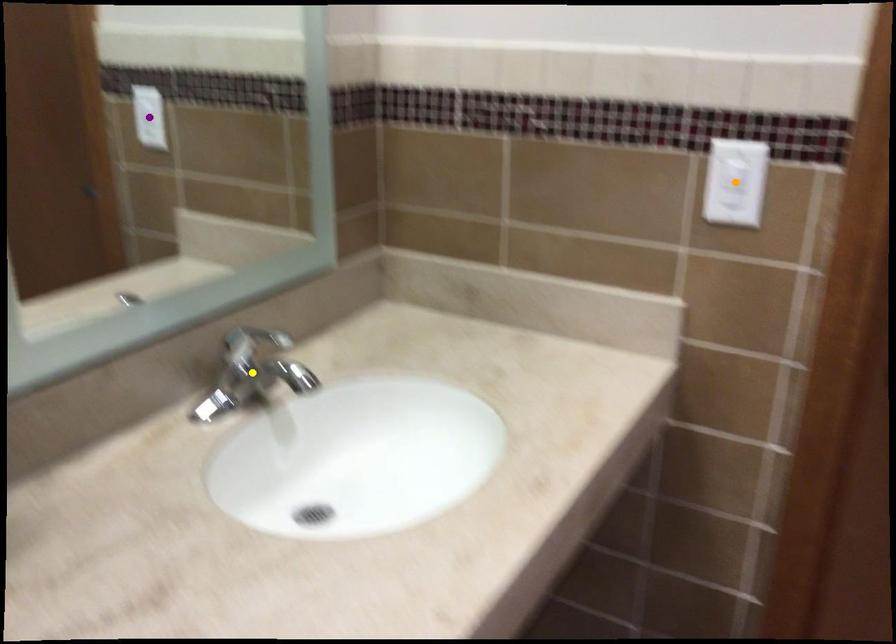
Order these from farthest to nearest:
1. orange point
2. yellow point
3. purple point

purple point → yellow point → orange point